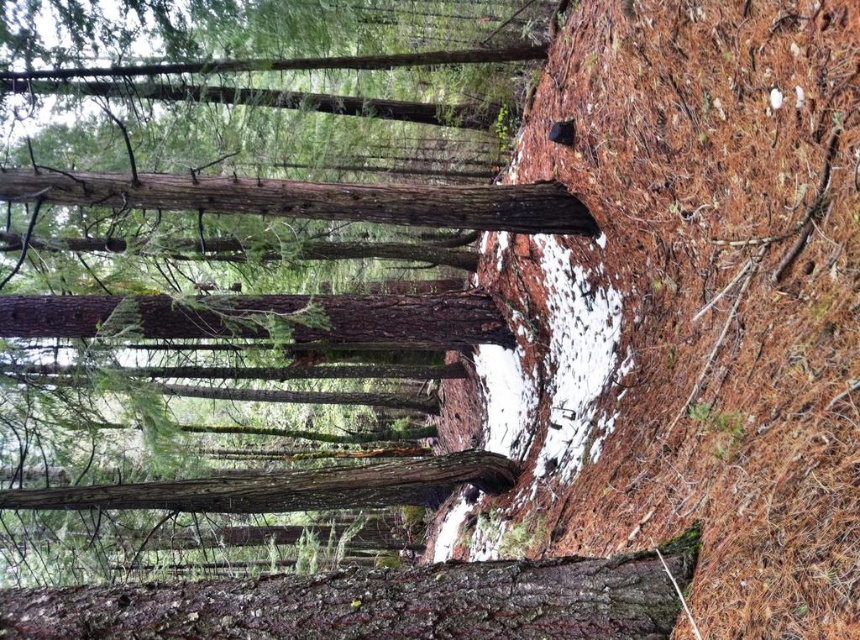
Question: Among these objects, which one is nearest to the camera?

Choices:
 (A) smooth brown tree trunk at center
 (B) rough bark tree trunk at center
 (C) brown/dry pine needles at lower right

Answer: (B)

Question: Considering the relative positions of smooth brown tree trunk at center and rough bark tree trunk at center in the image provided, where is smooth brown tree trunk at center located with respect to rough bark tree trunk at center?

Choices:
 (A) left
 (B) right

Answer: (A)

Question: Which of the following is the closest to the observer?

Choices:
 (A) click(x=268, y=600)
 (B) click(x=342, y=429)

Answer: (A)

Question: Is smooth brown tree trunk at center behind rough bark tree trunk at center?

Choices:
 (A) yes
 (B) no

Answer: (A)

Question: Which point is farther to the camera?

Choices:
 (A) (576, 564)
 (B) (736, 436)

Answer: (B)

Question: Is brown/dry pine needles at lower right wider than rough bark tree trunk at center?

Choices:
 (A) yes
 (B) no

Answer: (B)